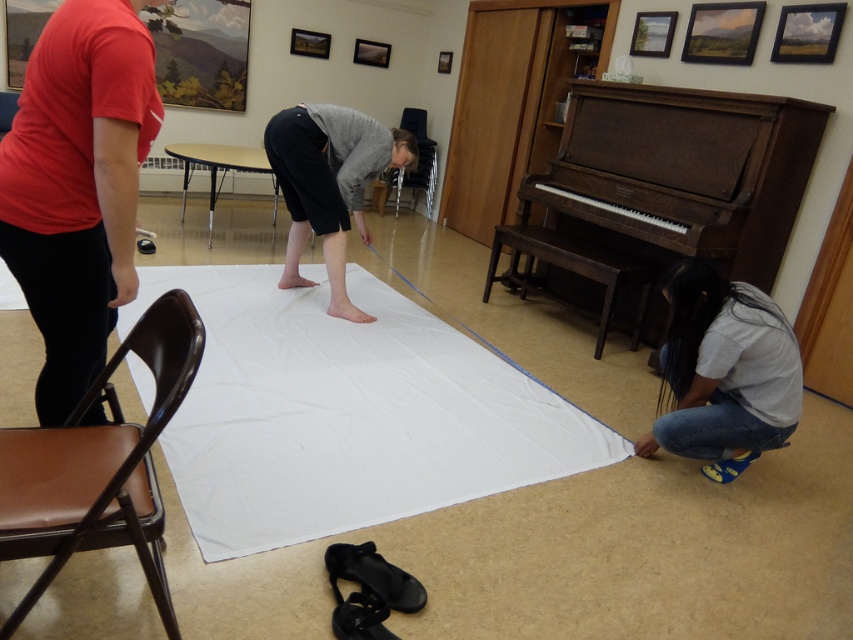
Question: Can you confirm if white matte cloth at center is smaller than wooden piano at center right?

Choices:
 (A) yes
 (B) no

Answer: (B)

Question: Which point is farther to the camera?

Choices:
 (A) white matte cloth at center
 (B) white cotton shirt at lower right
 (C) gray matte pants at center

Answer: (C)

Question: Which object is positioned farthest from the wooden piano at center right?

Choices:
 (A) gray matte pants at center
 (B) brown leather chair at lower left

Answer: (B)

Question: Observing the image, what is the correct spatial positioning of white cotton shirt at lower right in reference to black leather chair at center?

Choices:
 (A) below
 (B) above

Answer: (A)

Question: Among these points, which one is farthest from the camera?

Choices:
 (A) (407, 125)
 (B) (769, 365)

Answer: (A)

Question: Can you confirm if white matte cloth at center is positioned to the left of gray matte pants at center?

Choices:
 (A) yes
 (B) no

Answer: (A)